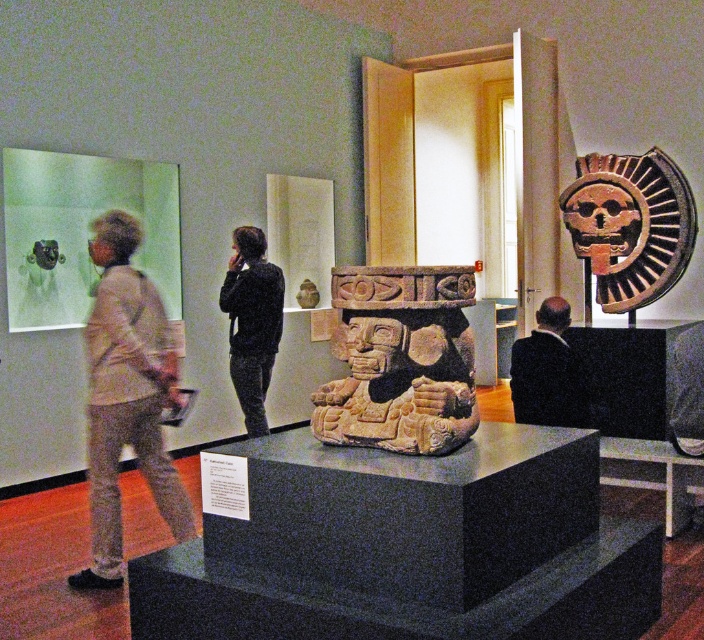
You are standing in the museum and want to take a photo of the point at coordinates point (458, 400). If your camera can focus on objects up to 8 feet away, will you be able to capture it clearly?

The distance of point (458, 400) from viewer is 7.68 feet, which is within the camera focus range of up to 8 feet. Therefore, you can capture it clearly.

You are a security guard in the museum and need to ensure that all visitors are maintaining a safe distance from the artifacts. The museum requires that visitors must be at least 1 meter away from any artifact. You see two visitors wearing a light beige sweater at left and a black suit at center. Based on their positions, which visitor is standing closer to the large stone sculpture on the dark square pedestal?

The light beige sweater at left has a greater height compared to the black suit at center, but this information does not indicate their distances from the sculpture. The question cannot be answered with the provided details.

You are a museum guide wearing a black suit at center and need to point out the brown terracotta mask at upper right to a visitor. Since the mask is larger than your suit, how can you ensure the visitor notices it?

The brown terracotta mask at upper right is larger in size compared to the black suit at center, so pointing towards it while mentioning its prominent size will help the visitor notice it immediately.